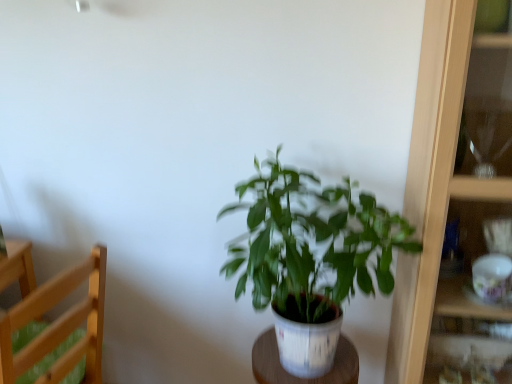
Question: Does white wood table at center have a lesser width compared to wooden cabinet at right?

Choices:
 (A) yes
 (B) no

Answer: (A)

Question: Considering the relative positions of white wood table at center and wooden cabinet at right in the image provided, is white wood table at center to the left of wooden cabinet at right from the viewer's perspective?

Choices:
 (A) yes
 (B) no

Answer: (A)

Question: Is white wood table at center next to wooden cabinet at right?

Choices:
 (A) yes
 (B) no

Answer: (B)

Question: Is wooden cabinet at right surrounded by white wood table at center?

Choices:
 (A) yes
 (B) no

Answer: (B)

Question: Considering the relative sizes of white wood table at center and wooden cabinet at right in the image provided, is white wood table at center smaller than wooden cabinet at right?

Choices:
 (A) yes
 (B) no

Answer: (A)

Question: Is white wood table at center completely or partially outside of wooden cabinet at right?

Choices:
 (A) yes
 (B) no

Answer: (A)

Question: Can you confirm if green matte plant at center is smaller than white wood table at center?

Choices:
 (A) yes
 (B) no

Answer: (B)

Question: Considering the relative positions of green matte plant at center and white wood table at center in the image provided, is green matte plant at center to the right of white wood table at center from the viewer's perspective?

Choices:
 (A) yes
 (B) no

Answer: (A)

Question: From a real-world perspective, is green matte plant at center under white wood table at center?

Choices:
 (A) yes
 (B) no

Answer: (B)

Question: Considering the relative sizes of green matte plant at center and white wood table at center in the image provided, is green matte plant at center shorter than white wood table at center?

Choices:
 (A) no
 (B) yes

Answer: (A)

Question: Could you tell me if green matte plant at center is turned towards white wood table at center?

Choices:
 (A) yes
 (B) no

Answer: (B)

Question: Can you confirm if green matte plant at center is bigger than white wood table at center?

Choices:
 (A) no
 (B) yes

Answer: (B)

Question: Considering the relative positions of light wood chair at left and wooden cabinet at right in the image provided, is light wood chair at left in front of wooden cabinet at right?

Choices:
 (A) yes
 (B) no

Answer: (B)